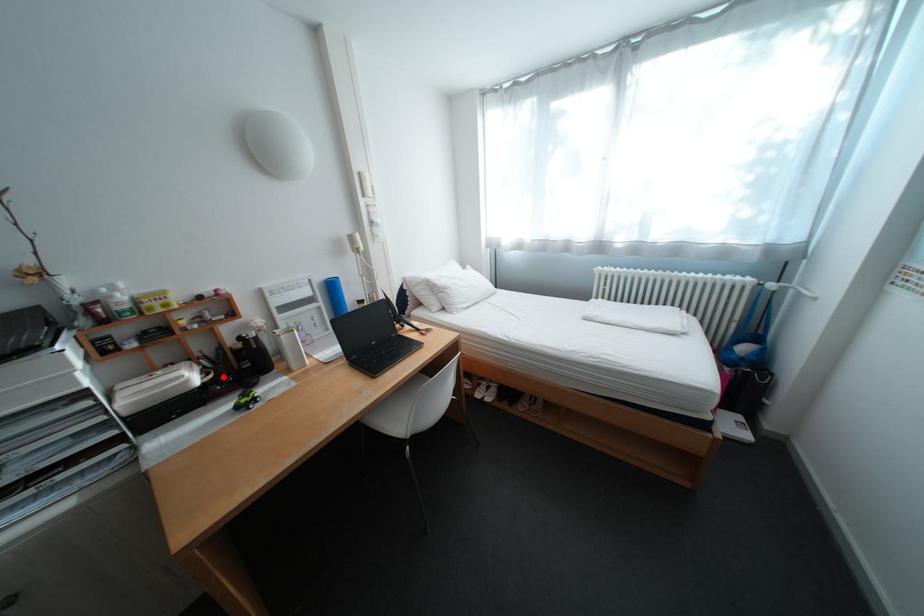
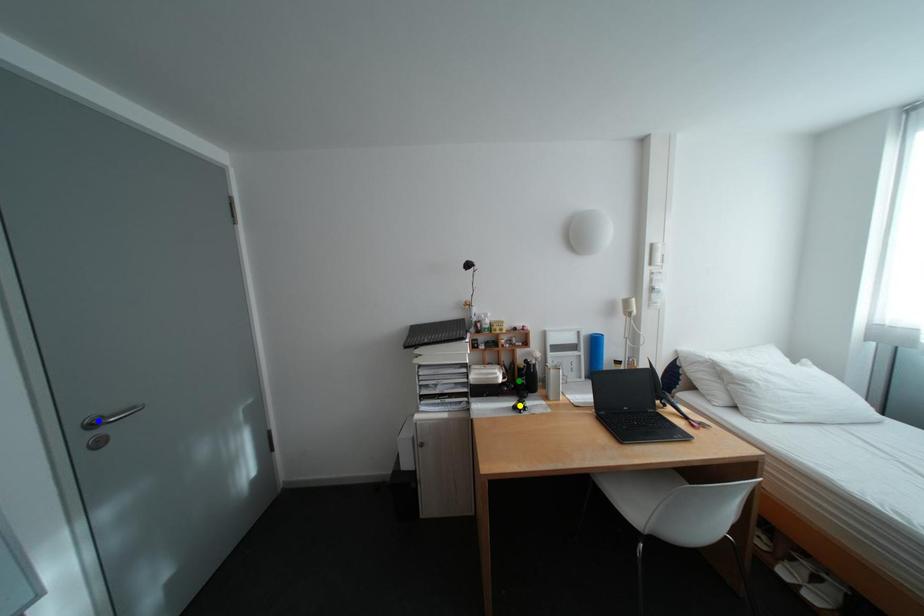
Question: I am providing you with two images of the same scene from different viewpoints. A red point is marked on the first image. You are given multiple points on the second image. Which point in image 2 is actually the same real-world point as the red point in image 1?

Choices:
 (A) green point
 (B) yellow point
 (C) blue point

Answer: (A)